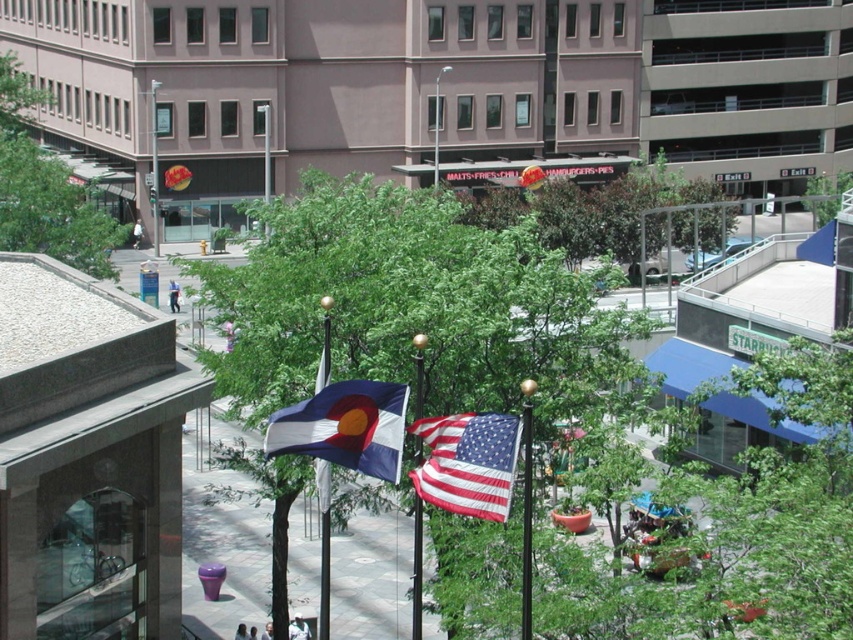
Is point (415, 540) closer to viewer compared to point (830, 180)?

Yes, point (415, 540) is closer to viewer.

Identify the location of metallic flagpole at center. The height and width of the screenshot is (640, 853). (416, 568).

Find the location of a particular element. Image resolution: width=853 pixels, height=640 pixels. metallic flagpole at center is located at coordinates (416, 568).

Is green leafy tree at upper left to the left of metallic flagpole at center from the viewer's perspective?

Indeed, green leafy tree at upper left is positioned on the left side of metallic flagpole at center.

The image size is (853, 640). What do you see at coordinates (45, 189) in the screenshot? I see `green leafy tree at upper left` at bounding box center [45, 189].

The height and width of the screenshot is (640, 853). Find the location of `green leafy tree at upper left`. green leafy tree at upper left is located at coordinates (45, 189).

Who is lower down, american flag at center or green leafy tree at center?

american flag at center is below.

Does american flag at center have a greater width compared to green leafy tree at center?

No, american flag at center is not wider than green leafy tree at center.

Which is in front, point (503, 499) or point (827, 188)?

Point (503, 499) is more forward.

You are a GUI agent. You are given a task and a screenshot of the screen. Output one action in this format:
    pyautogui.click(x=<x>, y=<y>)
    Task: Click on the american flag at center
    The image size is (853, 640).
    Given the screenshot: What is the action you would take?
    pyautogui.click(x=468, y=461)